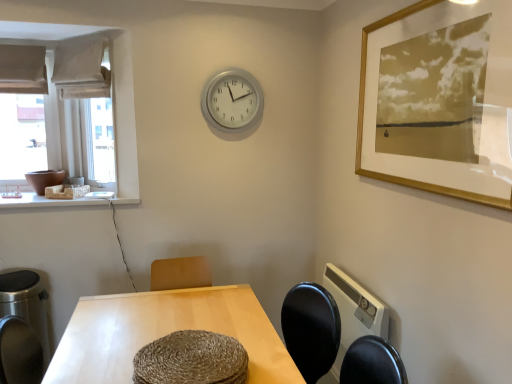
Question: Can you confirm if silver metallic clock at upper center is smaller than white fabric curtain at upper left?

Choices:
 (A) yes
 (B) no

Answer: (A)

Question: Does silver metallic clock at upper center have a greater width compared to white fabric curtain at upper left?

Choices:
 (A) no
 (B) yes

Answer: (A)

Question: Is the position of silver metallic clock at upper center more distant than that of white fabric curtain at upper left?

Choices:
 (A) no
 (B) yes

Answer: (B)

Question: Does silver metallic clock at upper center have a lesser width compared to white fabric curtain at upper left?

Choices:
 (A) yes
 (B) no

Answer: (A)

Question: From a real-world perspective, is silver metallic clock at upper center physically below white fabric curtain at upper left?

Choices:
 (A) no
 (B) yes

Answer: (B)

Question: Considering their positions, is gold framed print at upper right located in front of or behind silver metallic clock at upper center?

Choices:
 (A) front
 (B) behind

Answer: (A)

Question: From a real-world perspective, is gold framed print at upper right positioned above or below silver metallic clock at upper center?

Choices:
 (A) above
 (B) below

Answer: (B)

Question: Is gold framed print at upper right situated inside silver metallic clock at upper center or outside?

Choices:
 (A) outside
 (B) inside

Answer: (A)

Question: Considering the relative positions of gold framed print at upper right and silver metallic clock at upper center in the image provided, is gold framed print at upper right to the left or to the right of silver metallic clock at upper center?

Choices:
 (A) right
 (B) left

Answer: (A)

Question: Is silver metallic clock at upper center inside or outside of light wood table at center?

Choices:
 (A) inside
 (B) outside

Answer: (B)

Question: Is silver metallic clock at upper center wider or thinner than light wood table at center?

Choices:
 (A) wide
 (B) thin

Answer: (B)

Question: Considering the positions of silver metallic clock at upper center and light wood table at center in the image, is silver metallic clock at upper center taller or shorter than light wood table at center?

Choices:
 (A) tall
 (B) short

Answer: (B)

Question: Considering the positions of silver metallic clock at upper center and light wood table at center in the image, is silver metallic clock at upper center bigger or smaller than light wood table at center?

Choices:
 (A) big
 (B) small

Answer: (B)

Question: Looking at their shapes, would you say white stone at left is wider or thinner than white fabric curtain at upper left?

Choices:
 (A) thin
 (B) wide

Answer: (B)

Question: From their relative heights in the image, would you say white stone at left is taller or shorter than white fabric curtain at upper left?

Choices:
 (A) tall
 (B) short

Answer: (B)